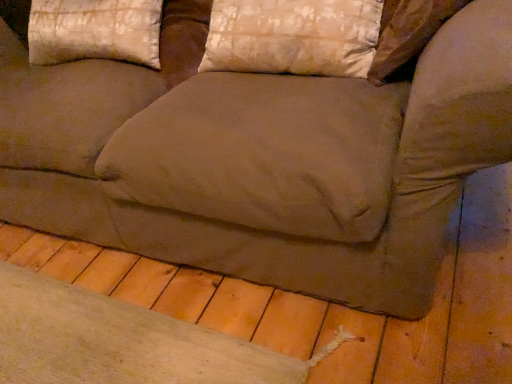
Question: In the image, is silky beige pillow at upper left, positioned as the 1th pillow in left-to-right order, positioned in front of or behind silky beige pillow at upper center, positioned as the first pillow in right-to-left order?

Choices:
 (A) front
 (B) behind

Answer: (B)

Question: Looking at their shapes, would you say silky beige pillow at upper left, arranged as the 2th pillow when viewed from the right, is wider or thinner than silky beige pillow at upper center, positioned as the first pillow in right-to-left order?

Choices:
 (A) thin
 (B) wide

Answer: (B)

Question: From a real-world perspective, is silky beige pillow at upper left, positioned as the 1th pillow in left-to-right order, positioned above or below silky beige pillow at upper center, which is the second pillow from left to right?

Choices:
 (A) below
 (B) above

Answer: (B)

Question: Looking at their shapes, would you say silky beige pillow at upper center, positioned as the first pillow in right-to-left order, is wider or thinner than silky beige pillow at upper left, positioned as the 1th pillow in left-to-right order?

Choices:
 (A) thin
 (B) wide

Answer: (A)

Question: Is point (208, 59) positioned closer to the camera than point (138, 34)?

Choices:
 (A) closer
 (B) farther

Answer: (A)

Question: Considering the positions of silky beige pillow at upper center, which is the second pillow from left to right, and silky beige pillow at upper left, positioned as the 1th pillow in left-to-right order, in the image, is silky beige pillow at upper center, which is the second pillow from left to right, bigger or smaller than silky beige pillow at upper left, positioned as the 1th pillow in left-to-right order,?

Choices:
 (A) small
 (B) big

Answer: (A)

Question: Is silky beige pillow at upper center, which is the second pillow from left to right, to the left or to the right of silky beige pillow at upper left, positioned as the 1th pillow in left-to-right order, in the image?

Choices:
 (A) left
 (B) right

Answer: (B)